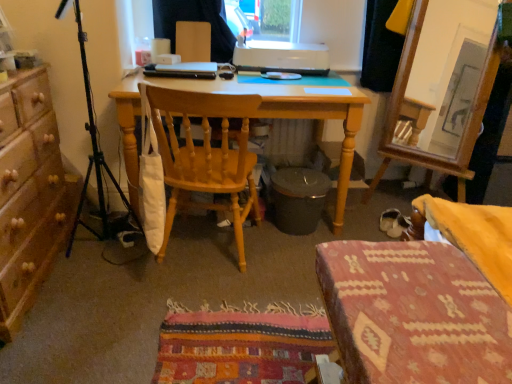
Locate an element on the screen. The height and width of the screenshot is (384, 512). free area below black matte tripod at left (from a real-world perspective) is located at coordinates (97, 252).